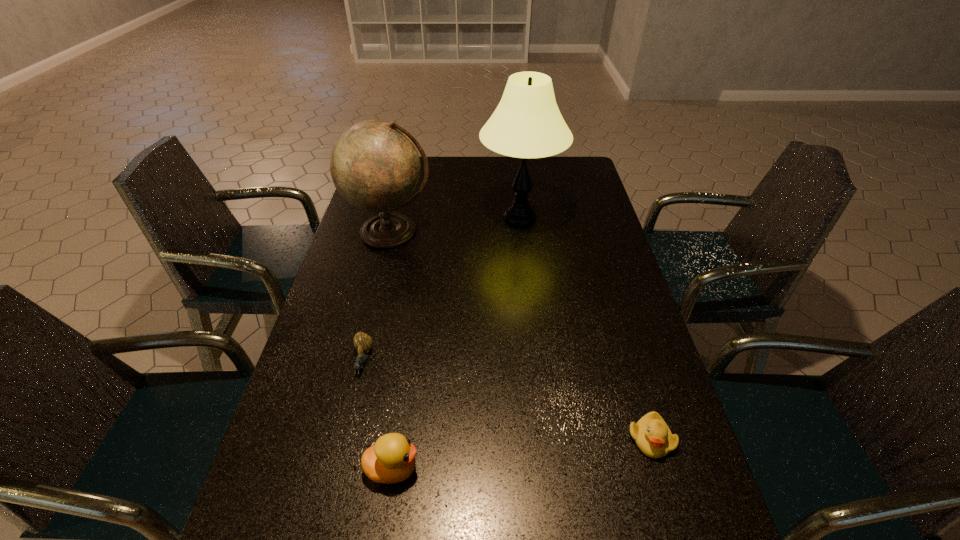
The width and height of the screenshot is (960, 540). I want to click on the fourth object from left to right, so click(x=527, y=123).

I want to click on lamp, so click(527, 123).

I want to click on globe, so click(x=375, y=166).

I want to click on the left duckling, so click(392, 459).

Where is `the taller duckling`? the taller duckling is located at coordinates (392, 459).

Locate an element on the screen. The width and height of the screenshot is (960, 540). the rightmost object is located at coordinates (652, 435).

Find the location of a particular element. The image size is (960, 540). the shorter duckling is located at coordinates (652, 435).

Find the location of a particular element. escargot is located at coordinates (362, 342).

Find the location of a particular element. free space located 0.080m on the left of the fourth object from left to right is located at coordinates (456, 218).

In order to click on free space located 0.340m on the front-facing side of the second tallest object in this screenshot , I will do `click(364, 343)`.